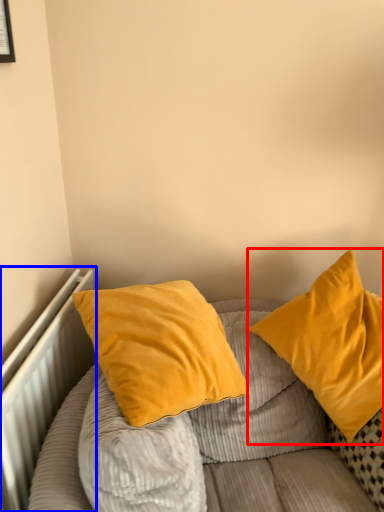
Question: Which point is further to the camera, pillow (highlighted by a red box) or radiator (highlighted by a blue box)?

Choices:
 (A) pillow
 (B) radiator

Answer: (A)